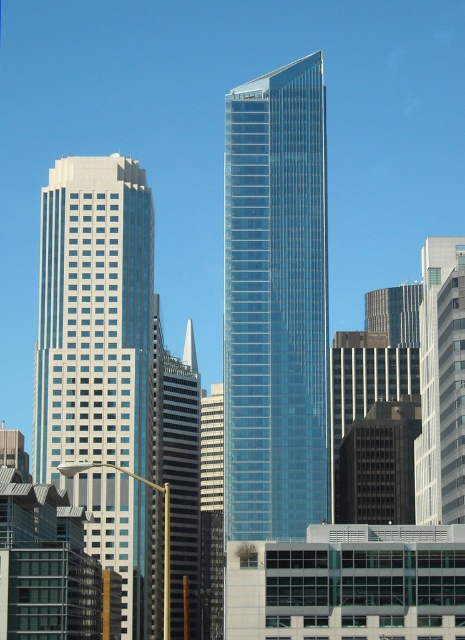
You are standing in the city looking at the buildings. There are two points marked in the image, one at point (x=101, y=392) and another at point (x=425, y=348). Which point is closer to you?

Point (x=101, y=392) is closer to the viewer than point (x=425, y=348).

You are a city planner assessing the layout of the city. You need to determine the relative positions of the transparent glass skyscraper at center and the white glass building at left for zoning purposes. Which building is positioned to the right of the other?

The transparent glass skyscraper at center is to the right of the white glass building at left, so the transparent glass skyscraper at center is positioned to the right of the white glass building at left.